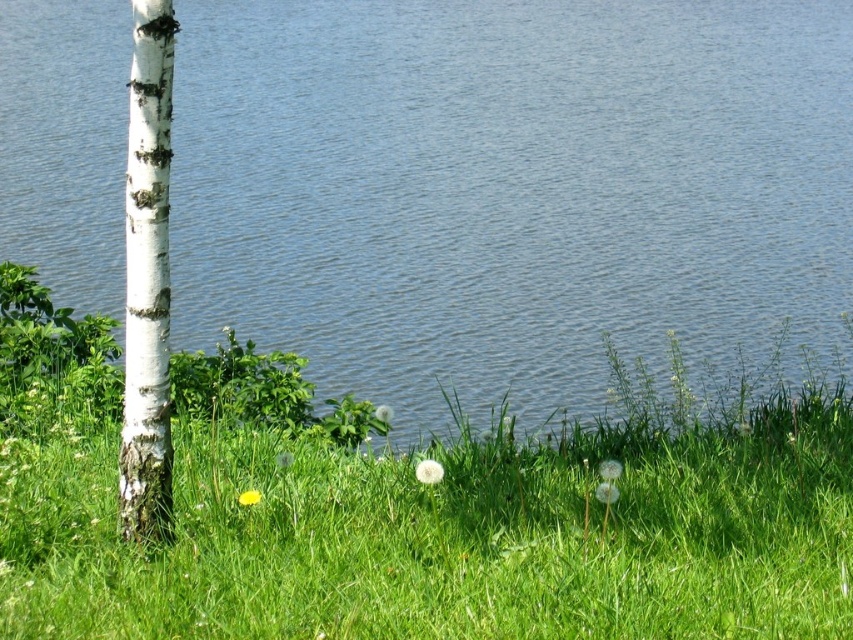
You are standing in the scene and want to place a small flag at each of the two points, point (447, 186) and point (161, 314). After placing them, which flag will appear closer to you?

The flag at point (447, 186) will appear closer to you because it is further to the camera than point (161, 314).

You are planning to set up a tent for a camping trip. You want to place it near the blue water at center but also want it to be within 50 feet of the white bark tree at left for easy access to shade. Is this possible?

Yes, because the distance between the blue water at center and the white bark tree at left is 43.11 feet, which is less than 50 feet, so placing the tent near the blue water at center would keep it within the desired distance of the white bark tree at left.